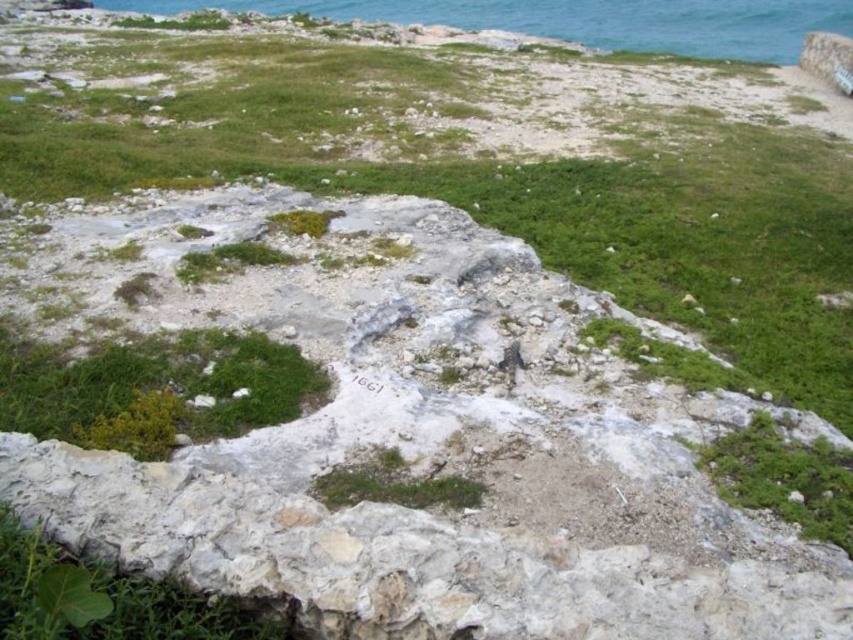
Does point (280, 387) lie in front of point (837, 33)?

Yes, point (280, 387) is in front of point (837, 33).

Is point (9, 378) positioned after point (677, 28)?

No, (9, 378) is closer to viewer.

You are a GUI agent. You are given a task and a screenshot of the screen. Output one action in this format:
    pyautogui.click(x=<x>, y=<y>)
    Task: Click on the green leafy grass at center
    The height and width of the screenshot is (640, 853).
    Given the screenshot: What is the action you would take?
    pyautogui.click(x=152, y=388)